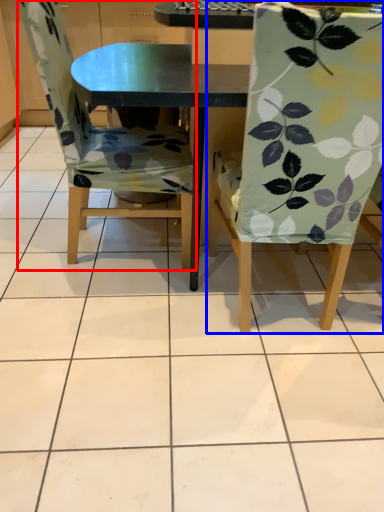
Question: Which object is further to the camera taking this photo, chair (highlighted by a red box) or chair (highlighted by a blue box)?

Choices:
 (A) chair
 (B) chair

Answer: (A)